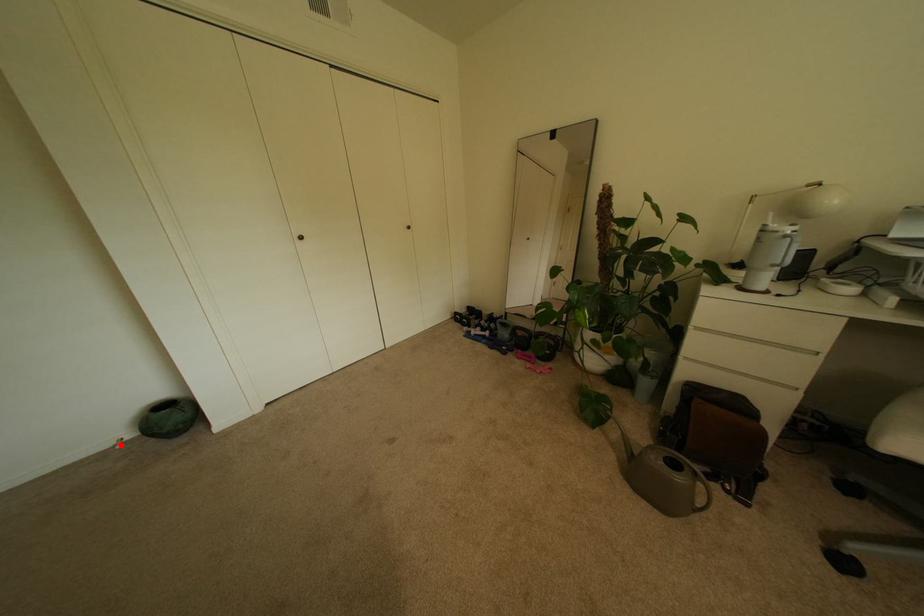
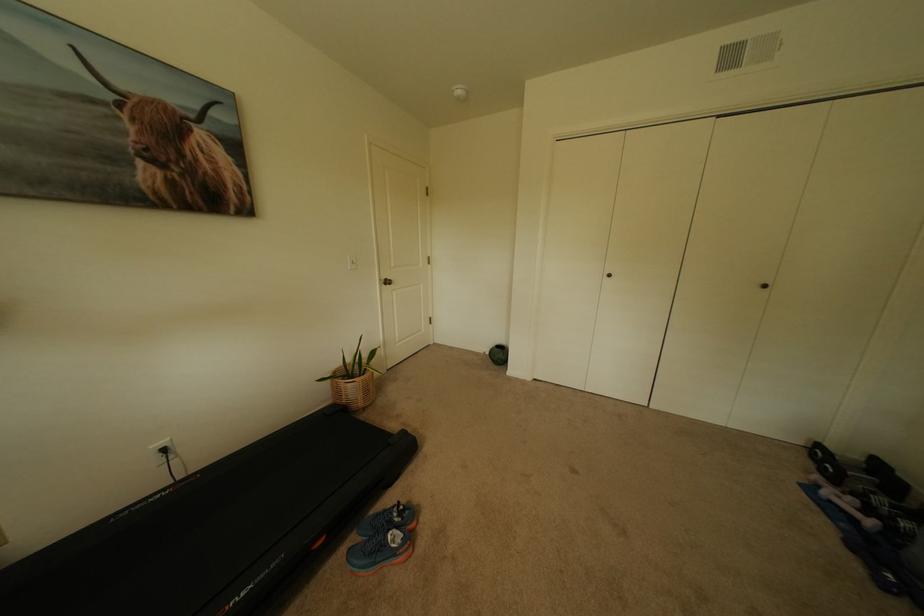
The point at the highlighted location is marked in the first image. Where is the corresponding point in the second image?

(491, 353)